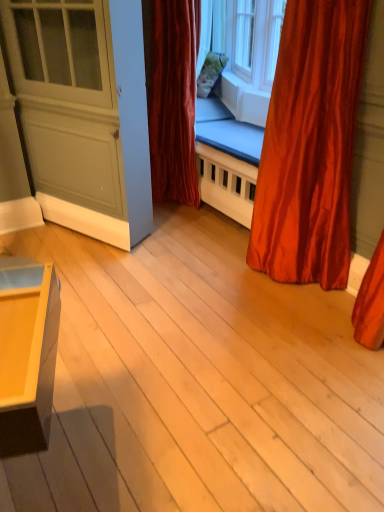
Locate an element on the screen. vacant space to the right of matte gray screen door at left is located at coordinates (186, 242).